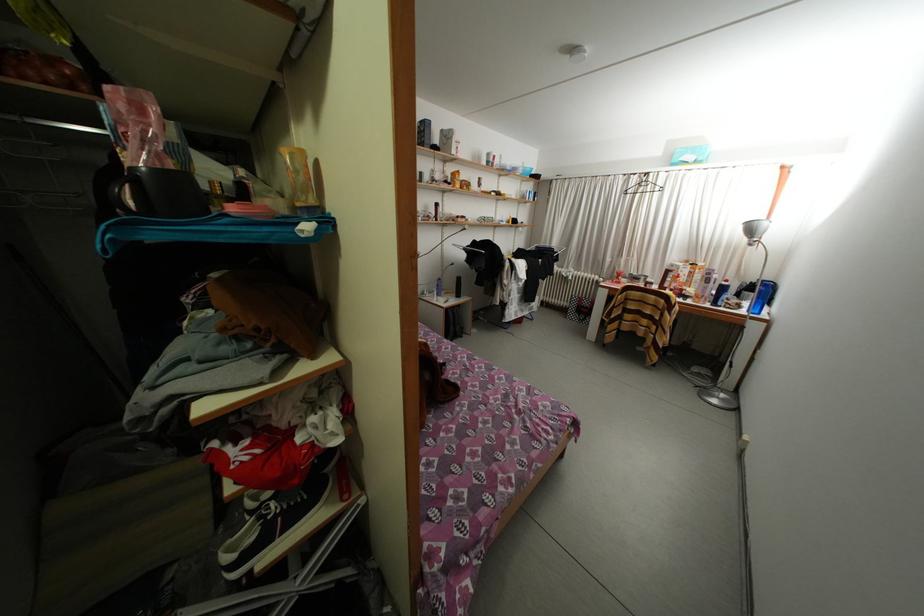
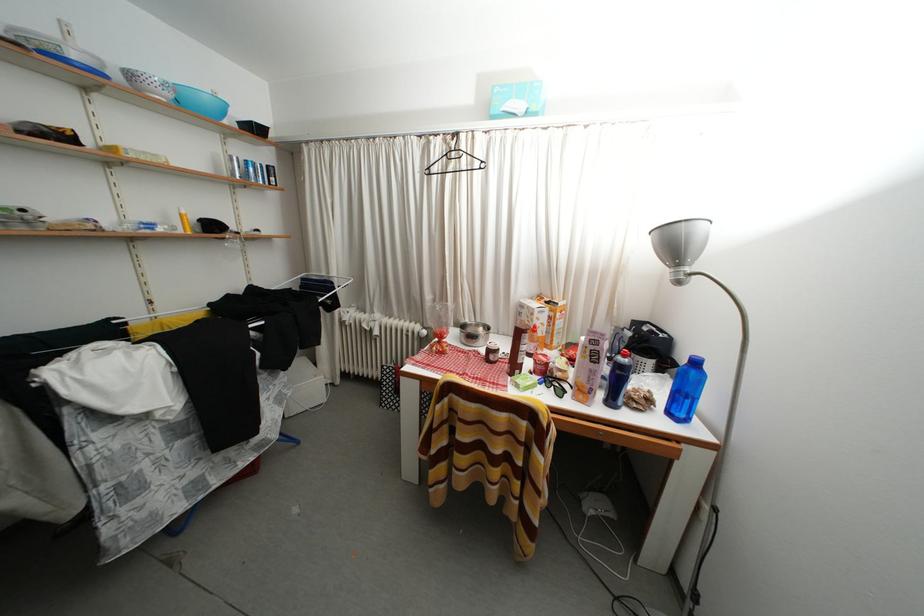
In the second image, find the point that corresponds to point (679, 270) in the first image.

(529, 310)